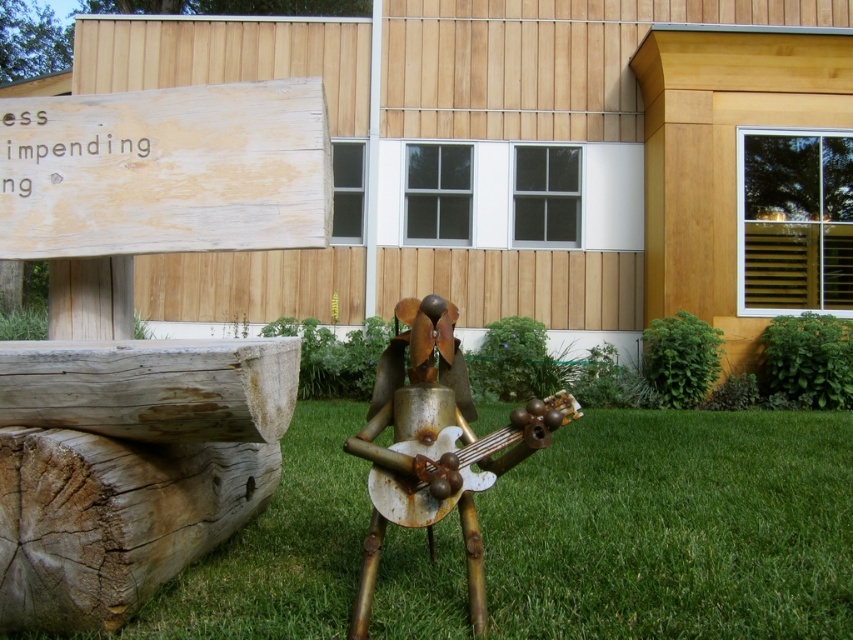
Question: Which point is farther to the camera?

Choices:
 (A) rusty metal guitar at center
 (B) green grass at center

Answer: (B)

Question: Among these points, which one is nearest to the camera?

Choices:
 (A) (263, 548)
 (B) (482, 476)

Answer: (B)

Question: Can you confirm if green grass at center is positioned to the right of rusty metal guitar at center?

Choices:
 (A) no
 (B) yes

Answer: (B)

Question: Which of the following is the closest to the observer?

Choices:
 (A) green grass at center
 (B) rusty metal guitar at center

Answer: (B)

Question: Does green grass at center lie in front of rusty metal guitar at center?

Choices:
 (A) yes
 (B) no

Answer: (B)

Question: Is green grass at center above rusty metal guitar at center?

Choices:
 (A) no
 (B) yes

Answer: (A)